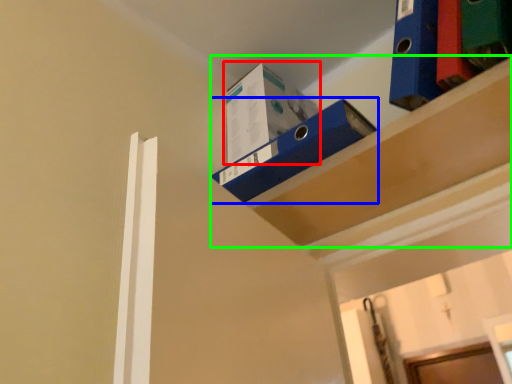
Question: Estimate the real-world distances between objects in this image. Which object is closer to box (highlighted by a red box), shelf (highlighted by a blue box) or shelf (highlighted by a green box)?

Choices:
 (A) shelf
 (B) shelf

Answer: (A)